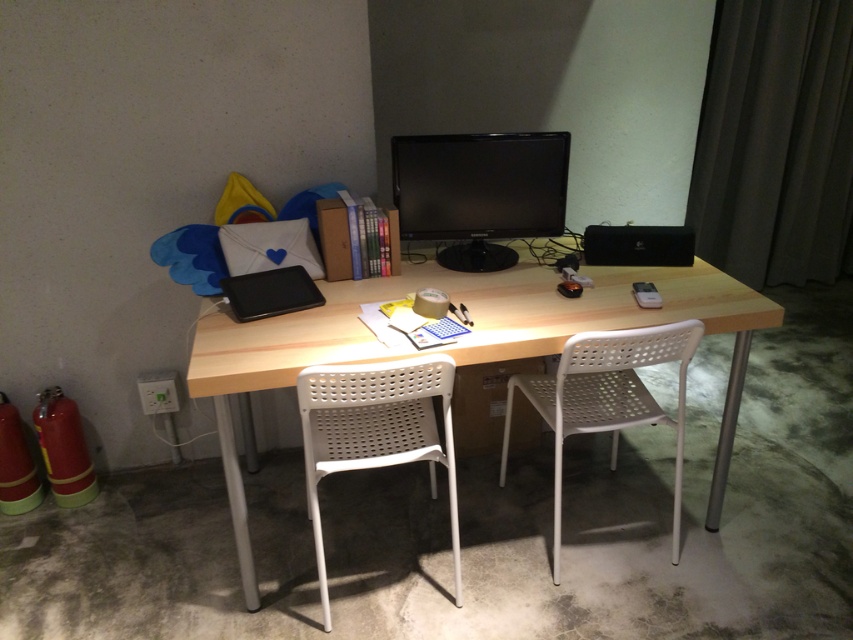
You are standing in the room and want to place a new lamp on the natural wood desk at center. Where exactly should you place it?

The natural wood desk at center is located at coordinates point (x=463, y=340), so place the lamp there.

You are organizing a small meeting in the workspace shown. You need to place a 12 inch wide notebook between the white perforated chair at center and the black matte laptop at center. Is there enough space between them to fit the notebook?

The white perforated chair at center and the black matte laptop at center are 16.51 inches apart from each other. Since the notebook is 12 inches wide, there is sufficient space between them to fit the notebook as 16.51 inches is greater than 12 inches.